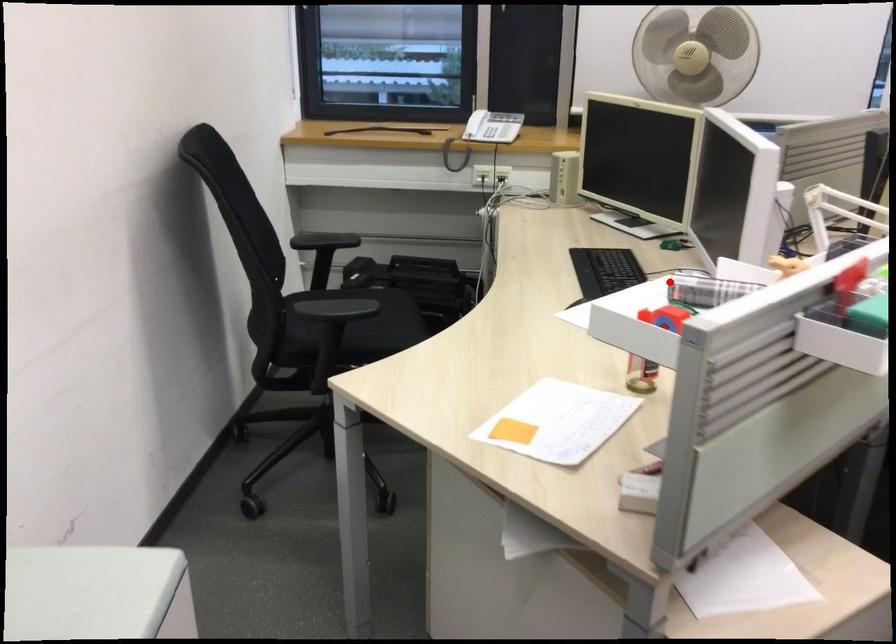
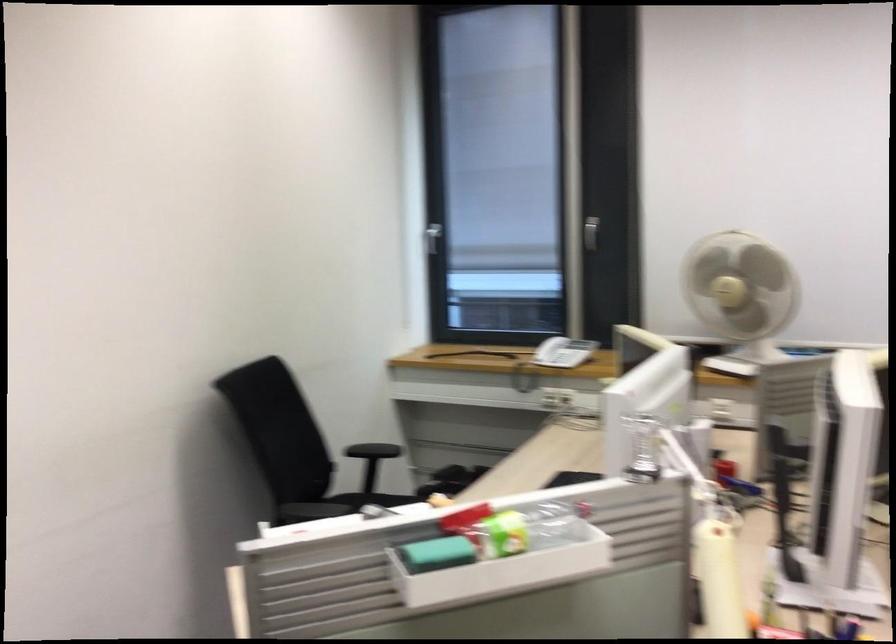
The point at the highlighted location is marked in the first image. Where is the corresponding point in the second image?

(367, 509)